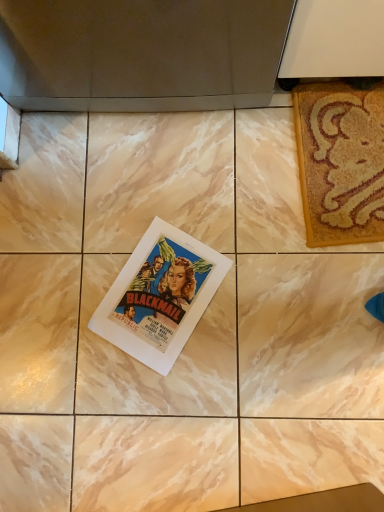
Identify the location of free point in front of white paper at center. (196, 393).